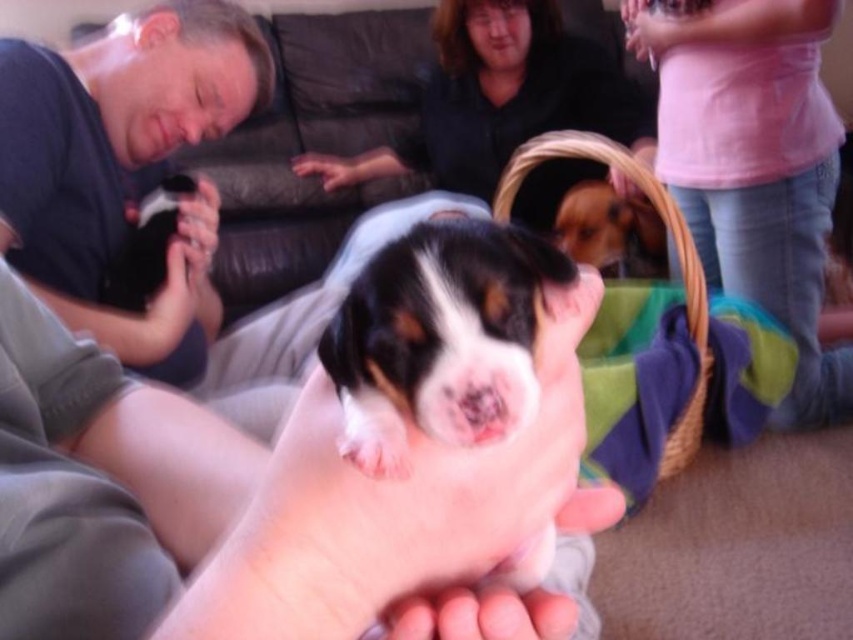
You are a delivery person who needs to place a package in the woven straw basket at upper center. The package is 5 feet in length. Can you fit the package into the basket?

The woven straw basket at upper center is 5.10 feet away from viewer. The distance between the delivery person and the basket is 5.10 feet, so the package length of 5 feet is shorter than the distance required to reach the basket. Therefore, the package cannot be placed into the basket.

You are a robotic arm that needs to pick up the white fur puppy at center without touching the smooth skin hand at center. What is the minimum distance you must maintain between the puppy and the hand?

The minimum distance you must maintain between the white fur puppy at center and the smooth skin hand at center is 2.33 meters to avoid contact.

You are organizing a clothing donation drive and need to determine which item can cover a larger surface area. Based on the scene, which object between the pink cotton shirt at upper right and the matte pink hand at upper center is wider?

The pink cotton shirt at upper right is wider than the matte pink hand at upper center.